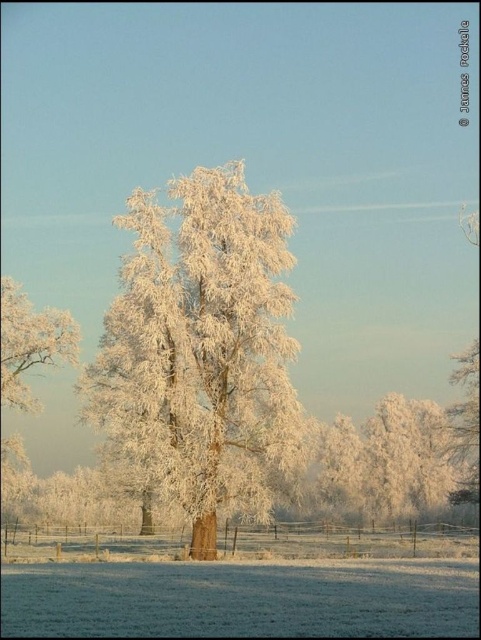
You are an observer standing in front of the frosted white tree at center and the frosty white tree at left. Which tree do you think is taller?

The frosted white tree at center is taller than the frosty white tree at left.

You are an artist wanting to paint the winter landscape. You notice the frosted white tree at center and the frosty white tree at left. Which tree should you paint larger to accurately represent their sizes in the scene?

You should paint the frosted white tree at center larger than the frosty white tree at left because it is actually larger in size according to the description.

You are an arborist measuring the distance between two frosty trees in a winter landscape. You have a measuring tape that can extend up to 10 meters. Can you measure the distance between the frosted white tree at center and the frosty white tree at left without needing a longer tape?

The frosted white tree at center and frosty white tree at left are 12.61 meters apart, which exceeds the 10 meter limit of your measuring tape. You will need a longer tape to measure the distance between them.